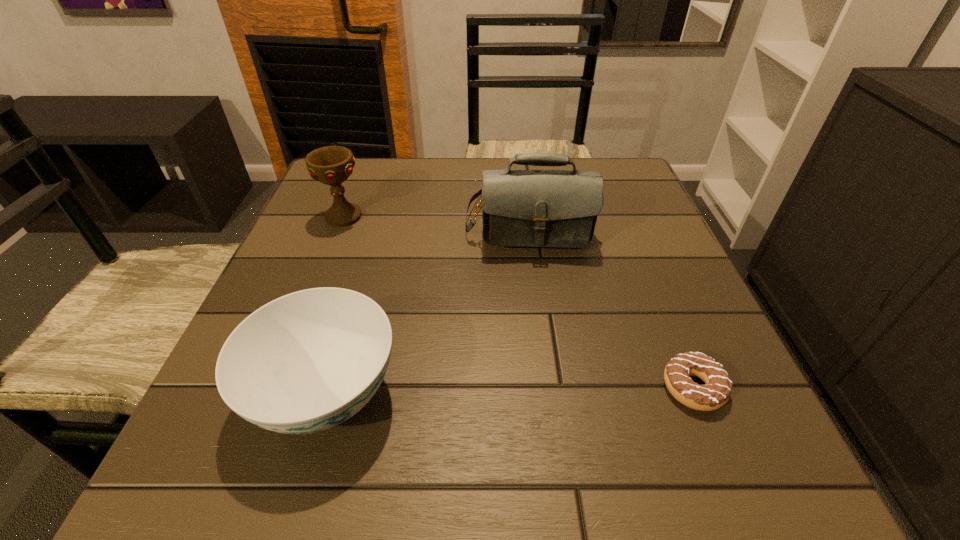
This screenshot has width=960, height=540. In the image, there is a desktop. In order to click on vacant space at the far edge in this screenshot , I will do click(391, 192).

You are a GUI agent. You are given a task and a screenshot of the screen. Output one action in this format:
    pyautogui.click(x=<x>, y=<y>)
    Task: Click on the free space at the near edge
    The height and width of the screenshot is (540, 960).
    Given the screenshot: What is the action you would take?
    pyautogui.click(x=344, y=465)

At what (x,y) coordinates should I click in order to perform the action: click on vacant space at the right edge. Please return your answer as a coordinate pair (x, y). Looking at the image, I should click on pyautogui.click(x=740, y=394).

At what (x,y) coordinates should I click in order to perform the action: click on free space at the far left corner of the desktop. Please return your answer as a coordinate pair (x, y). Looking at the image, I should click on (357, 205).

Where is `vacant area at the near left corner`? This screenshot has width=960, height=540. vacant area at the near left corner is located at coordinates [250, 472].

Identify the location of free location at the far right corner. This screenshot has width=960, height=540. [x=606, y=167].

The width and height of the screenshot is (960, 540). Find the location of `vacant area at the near right corner`. vacant area at the near right corner is located at coordinates (663, 476).

Image resolution: width=960 pixels, height=540 pixels. Identify the location of blank region between the chalice and the third object from left to right. (435, 215).

At what (x,y) coordinates should I click in order to perform the action: click on vacant space that's between the tallest object and the chalice. Please return your answer as a coordinate pair (x, y). This screenshot has width=960, height=540. Looking at the image, I should click on (435, 215).

Find the location of a particular element. Image resolution: width=960 pixels, height=540 pixels. free space between the chalice and the shoulder bag is located at coordinates (x=435, y=215).